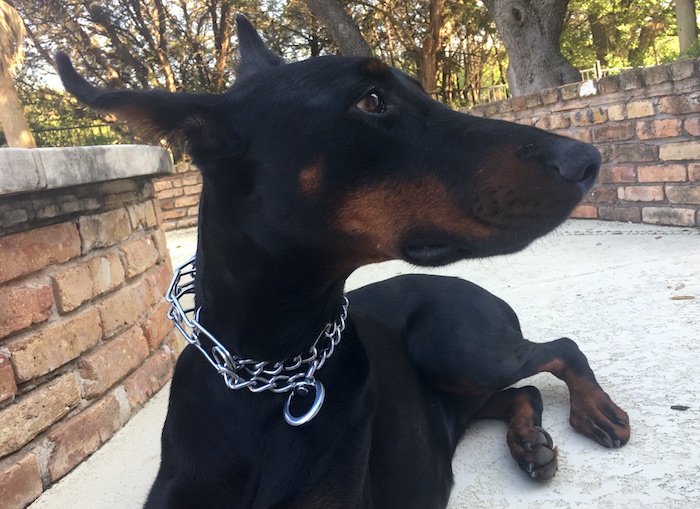
Locate an element on the screen. wall is located at coordinates (59, 336).